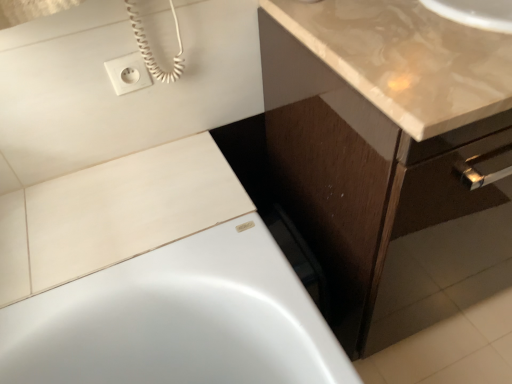
Question: From the image's perspective, is white matte tile at upper left on brown wood cabinet at lower right?

Choices:
 (A) yes
 (B) no

Answer: (B)

Question: Is white matte tile at upper left wider than brown wood cabinet at lower right?

Choices:
 (A) no
 (B) yes

Answer: (A)

Question: Considering the relative sizes of white matte tile at upper left and brown wood cabinet at lower right in the image provided, is white matte tile at upper left bigger than brown wood cabinet at lower right?

Choices:
 (A) no
 (B) yes

Answer: (A)

Question: Does white matte tile at upper left touch brown wood cabinet at lower right?

Choices:
 (A) no
 (B) yes

Answer: (A)

Question: Is white matte tile at upper left facing away from brown wood cabinet at lower right?

Choices:
 (A) no
 (B) yes

Answer: (A)

Question: Based on their sizes in the image, would you say glossy beige countertop at upper right is bigger or smaller than white matte tile at upper left?

Choices:
 (A) big
 (B) small

Answer: (A)

Question: From a real-world perspective, relative to white matte tile at upper left, is glossy beige countertop at upper right vertically above or below?

Choices:
 (A) below
 (B) above

Answer: (B)

Question: Visually, is glossy beige countertop at upper right positioned to the left or to the right of white matte tile at upper left?

Choices:
 (A) left
 (B) right

Answer: (B)

Question: Is point (457, 28) positioned closer to the camera than point (210, 147)?

Choices:
 (A) farther
 (B) closer

Answer: (B)

Question: In the image, is white plastic outlet at upper left on the left side or the right side of brown wood cabinet at lower right?

Choices:
 (A) right
 (B) left

Answer: (B)

Question: In the image, is white plastic outlet at upper left positioned in front of or behind brown wood cabinet at lower right?

Choices:
 (A) front
 (B) behind

Answer: (B)

Question: Choose the correct answer: Is white plastic outlet at upper left inside brown wood cabinet at lower right or outside it?

Choices:
 (A) inside
 (B) outside

Answer: (B)

Question: Considering the positions of white plastic outlet at upper left and brown wood cabinet at lower right in the image, is white plastic outlet at upper left wider or thinner than brown wood cabinet at lower right?

Choices:
 (A) thin
 (B) wide

Answer: (A)

Question: Looking at the image, does white matte tile at upper left seem bigger or smaller compared to white plastic outlet at upper left?

Choices:
 (A) small
 (B) big

Answer: (B)

Question: Choose the correct answer: Is white matte tile at upper left inside white plastic outlet at upper left or outside it?

Choices:
 (A) inside
 (B) outside

Answer: (B)